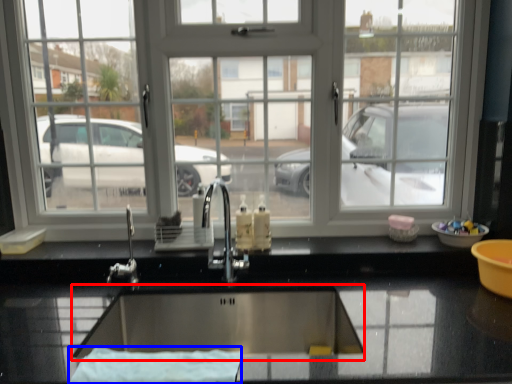
Question: Which object is closer to the camera taking this photo, wide (highlighted by a red box) or bath towel (highlighted by a blue box)?

Choices:
 (A) wide
 (B) bath towel

Answer: (B)